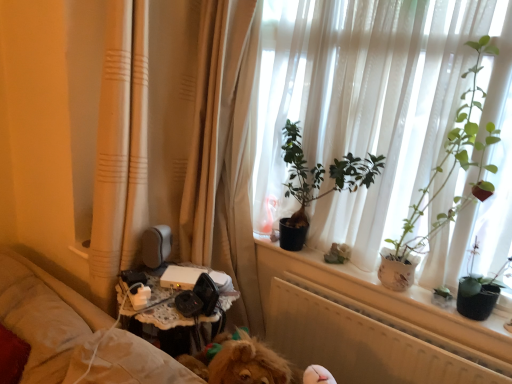
Measure the distance between point (488, 46) and camera.

Point (488, 46) is 1.51 meters from camera.

You are a GUI agent. You are given a task and a screenshot of the screen. Output one action in this format:
    pyautogui.click(x=<x>, y=<y>)
    Task: Click on the green matte plant at center, acting as the first houseplant starting from the left
    
    Given the screenshot: What is the action you would take?
    pyautogui.click(x=321, y=175)

Is green matte plant at center, acting as the first houseplant starting from the left, completely or partially outside of green matte plant at upper right, placed as the 2th houseplant when sorted from left to right?

Indeed, green matte plant at center, acting as the first houseplant starting from the left, is completely outside green matte plant at upper right, placed as the 2th houseplant when sorted from left to right.

Is point (293, 187) closer to camera compared to point (403, 290)?

No, (293, 187) is further to viewer.

What's the angular difference between green matte plant at center, the 2th houseplant positioned from the right, and green matte plant at upper right, placed as the 2th houseplant when sorted from left to right,'s facing directions?

The facing directions of green matte plant at center, the 2th houseplant positioned from the right, and green matte plant at upper right, placed as the 2th houseplant when sorted from left to right, are 0.000984 degrees apart.

Would you say green matte plant at center, acting as the first houseplant starting from the left, is to the left or to the right of green matte plant at upper right, placed as the 2th houseplant when sorted from left to right, in the picture?

In the image, green matte plant at center, acting as the first houseplant starting from the left, appears on the left side of green matte plant at upper right, placed as the 2th houseplant when sorted from left to right.

Who is shorter, green matte plant at upper right, which is counted as the 1th houseplant, starting from the right, or green matte plant at center, the 2th houseplant positioned from the right?

Standing shorter between the two is green matte plant at center, the 2th houseplant positioned from the right.

How different are the orientations of green matte plant at upper right, placed as the 2th houseplant when sorted from left to right, and green matte plant at center, the 2th houseplant positioned from the right, in degrees?

There is a 0.000984-degree angle between the facing directions of green matte plant at upper right, placed as the 2th houseplant when sorted from left to right, and green matte plant at center, the 2th houseplant positioned from the right.

Which of these two, green matte plant at upper right, placed as the 2th houseplant when sorted from left to right, or green matte plant at center, the 2th houseplant positioned from the right, is thinner?

green matte plant at center, the 2th houseplant positioned from the right, is thinner.

From a real-world perspective, is green matte plant at upper right, placed as the 2th houseplant when sorted from left to right, on green matte plant at center, acting as the first houseplant starting from the left?

Yes, from a real-world perspective, green matte plant at upper right, placed as the 2th houseplant when sorted from left to right, is above green matte plant at center, acting as the first houseplant starting from the left.

The height and width of the screenshot is (384, 512). Find the location of `houseplant below the beige fabric curtain at left (from a real-world perspective)`. houseplant below the beige fabric curtain at left (from a real-world perspective) is located at coordinates (321, 175).

Considering the positions of objects beige fabric curtain at left and green matte plant at center, acting as the first houseplant starting from the left, in the image provided, who is in front, beige fabric curtain at left or green matte plant at center, acting as the first houseplant starting from the left,?

beige fabric curtain at left is more forward.

How different are the orientations of beige fabric curtain at left and green matte plant at center, the 2th houseplant positioned from the right, in degrees?

They differ by 0.29 degrees in their facing directions.

Is beige fabric curtain at left taller or shorter than green matte plant at center, acting as the first houseplant starting from the left?

beige fabric curtain at left is taller than green matte plant at center, acting as the first houseplant starting from the left.

Can you confirm if green matte plant at upper right, which is counted as the 1th houseplant, starting from the right, is wider than beige fabric curtain at left?

No, green matte plant at upper right, which is counted as the 1th houseplant, starting from the right, is not wider than beige fabric curtain at left.

Is point (470, 105) closer to viewer compared to point (208, 99)?

That is True.

Consider the image. Is green matte plant at upper right, which is counted as the 1th houseplant, starting from the right, facing towards beige fabric curtain at left?

No, green matte plant at upper right, which is counted as the 1th houseplant, starting from the right, is not turned towards beige fabric curtain at left.

Considering the sizes of objects green matte plant at upper right, which is counted as the 1th houseplant, starting from the right, and beige fabric curtain at left in the image provided, who is taller, green matte plant at upper right, which is counted as the 1th houseplant, starting from the right, or beige fabric curtain at left?

Standing taller between the two is beige fabric curtain at left.

Is green matte plant at center, the 2th houseplant positioned from the right, wider or thinner than beige fabric curtain at left?

Clearly, green matte plant at center, the 2th houseplant positioned from the right, has less width compared to beige fabric curtain at left.

Which is closer, (x=302, y=182) or (x=185, y=244)?

Clearly, point (x=302, y=182) is closer to the camera than point (x=185, y=244).

Consider the image. Considering the positions of objects green matte plant at center, acting as the first houseplant starting from the left, and beige fabric curtain at left in the image provided, who is more to the left, green matte plant at center, acting as the first houseplant starting from the left, or beige fabric curtain at left?

beige fabric curtain at left.

Is green matte plant at center, acting as the first houseplant starting from the left, shorter than beige fabric curtain at left?

Yes.

Considering the sizes of objects beige fabric curtain at left and green matte plant at upper right, which is counted as the 1th houseplant, starting from the right, in the image provided, who is taller, beige fabric curtain at left or green matte plant at upper right, which is counted as the 1th houseplant, starting from the right,?

Standing taller between the two is beige fabric curtain at left.

From a real-world perspective, is beige fabric curtain at left on green matte plant at upper right, placed as the 2th houseplant when sorted from left to right?

Actually, beige fabric curtain at left is physically below green matte plant at upper right, placed as the 2th houseplant when sorted from left to right, in the real world.

Is beige fabric curtain at left positioned far away from green matte plant at upper right, placed as the 2th houseplant when sorted from left to right?

No.

Image resolution: width=512 pixels, height=384 pixels. What are the coordinates of `houseplant that appears below the green matte plant at upper right, which is counted as the 1th houseplant, starting from the right (from the image's perspective)` in the screenshot? It's located at (321, 175).

Where is `houseplant on the right of green matte plant at center, the 2th houseplant positioned from the right`? The image size is (512, 384). houseplant on the right of green matte plant at center, the 2th houseplant positioned from the right is located at coordinates (444, 181).

Looking at the image, which one is located further to green matte plant at center, the 2th houseplant positioned from the right, green matte plant at upper right, placed as the 2th houseplant when sorted from left to right, or beige fabric curtain at left?

Among the two, green matte plant at upper right, placed as the 2th houseplant when sorted from left to right, is located further to green matte plant at center, the 2th houseplant positioned from the right.

Estimate the real-world distances between objects in this image. Which object is closer to beige fabric curtain at left, green matte plant at upper right, placed as the 2th houseplant when sorted from left to right, or green matte plant at center, acting as the first houseplant starting from the left?

Based on the image, green matte plant at center, acting as the first houseplant starting from the left, appears to be nearer to beige fabric curtain at left.

Considering their positions, is beige fabric curtain at left positioned further to green matte plant at upper right, placed as the 2th houseplant when sorted from left to right, than green matte plant at center, the 2th houseplant positioned from the right?

beige fabric curtain at left.

Looking at the image, which one is located closer to green matte plant at center, the 2th houseplant positioned from the right, beige fabric curtain at left or green matte plant at upper right, placed as the 2th houseplant when sorted from left to right?

beige fabric curtain at left lies closer to green matte plant at center, the 2th houseplant positioned from the right, than the other object.

From the image, which object appears to be nearer to beige fabric curtain at left, green matte plant at center, the 2th houseplant positioned from the right, or green matte plant at upper right, which is counted as the 1th houseplant, starting from the right?

green matte plant at center, the 2th houseplant positioned from the right, is positioned closer to the anchor beige fabric curtain at left.

Based on their spatial positions, is green matte plant at center, acting as the first houseplant starting from the left, or beige fabric curtain at left further from green matte plant at upper right, placed as the 2th houseplant when sorted from left to right?

The object further to green matte plant at upper right, placed as the 2th houseplant when sorted from left to right, is beige fabric curtain at left.

The image size is (512, 384). In order to click on houseplant between beige fabric curtain at left and green matte plant at upper right, placed as the 2th houseplant when sorted from left to right in this screenshot , I will do pyautogui.click(x=321, y=175).